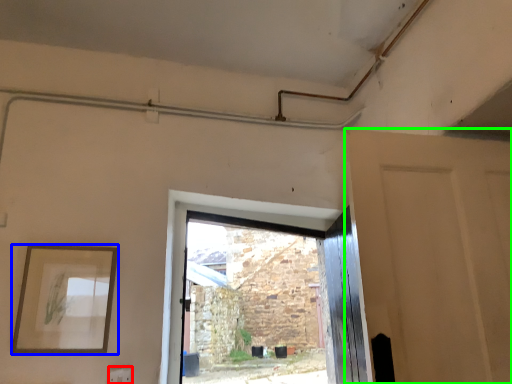
Question: Which is nearer to the electric outlet (highlighted by a red box)? picture frame (highlighted by a blue box) or door (highlighted by a green box).

Choices:
 (A) picture frame
 (B) door

Answer: (A)